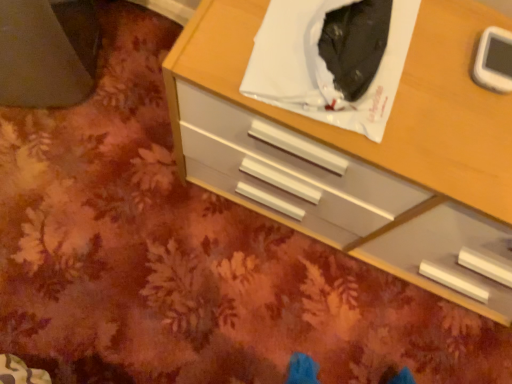
Where is `empty space that is ontop of wooden chest of drawers at upper center (from a real-world perspective)`? This screenshot has width=512, height=384. empty space that is ontop of wooden chest of drawers at upper center (from a real-world perspective) is located at coordinates (389, 76).